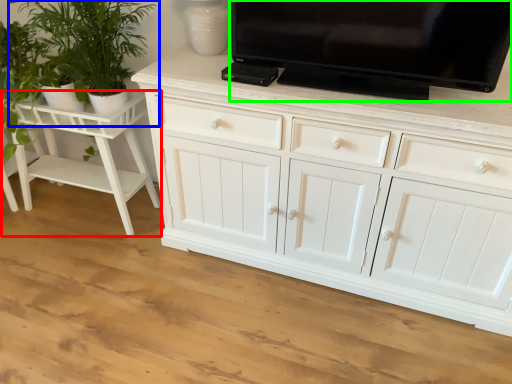
Question: Which object is positioned closest to vanity (highlighted by a red box)? Select from houseplant (highlighted by a blue box) and television (highlighted by a green box).

Choices:
 (A) houseplant
 (B) television

Answer: (A)